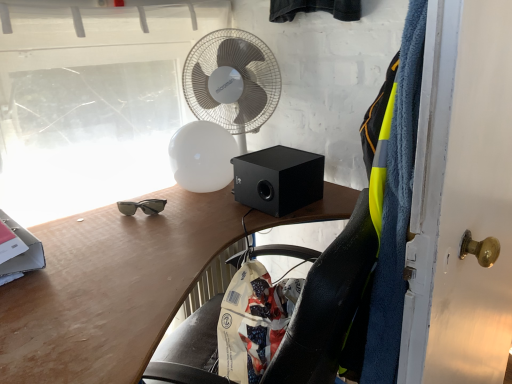
Question: Is white plastic mechanical fan at upper center bigger than black matte speaker at center?

Choices:
 (A) yes
 (B) no

Answer: (A)

Question: Is white plastic mechanical fan at upper center shorter than black matte speaker at center?

Choices:
 (A) yes
 (B) no

Answer: (B)

Question: Is black matte speaker at center a part of white plastic mechanical fan at upper center?

Choices:
 (A) no
 (B) yes

Answer: (A)

Question: Is white plastic mechanical fan at upper center with black matte speaker at center?

Choices:
 (A) no
 (B) yes

Answer: (A)

Question: Considering the relative sizes of white plastic mechanical fan at upper center and black matte speaker at center in the image provided, is white plastic mechanical fan at upper center thinner than black matte speaker at center?

Choices:
 (A) no
 (B) yes

Answer: (B)

Question: Can you confirm if white plastic mechanical fan at upper center is wider than black matte speaker at center?

Choices:
 (A) yes
 (B) no

Answer: (B)

Question: Would you say white plastic mechanical fan at upper center contains matte wood desk at center?

Choices:
 (A) yes
 (B) no

Answer: (B)

Question: Is white plastic mechanical fan at upper center turned away from matte wood desk at center?

Choices:
 (A) no
 (B) yes

Answer: (A)

Question: From the image's perspective, is white plastic mechanical fan at upper center over matte wood desk at center?

Choices:
 (A) no
 (B) yes

Answer: (B)

Question: Is white plastic mechanical fan at upper center oriented towards matte wood desk at center?

Choices:
 (A) yes
 (B) no

Answer: (B)

Question: Is white plastic mechanical fan at upper center to the right of matte wood desk at center from the viewer's perspective?

Choices:
 (A) no
 (B) yes

Answer: (A)

Question: Can you confirm if white plastic mechanical fan at upper center is smaller than matte wood desk at center?

Choices:
 (A) yes
 (B) no

Answer: (A)

Question: Are black matte speaker at center and matte wood desk at center making contact?

Choices:
 (A) no
 (B) yes

Answer: (A)